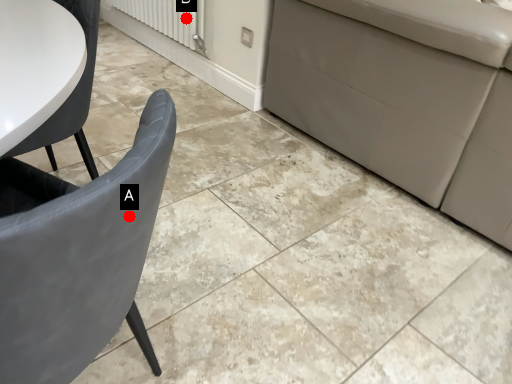
Question: Two points are circled on the image, labeled by A and B beside each circle. Which of the following is the farthest from the observer?

Choices:
 (A) A is further
 (B) B is further

Answer: (B)